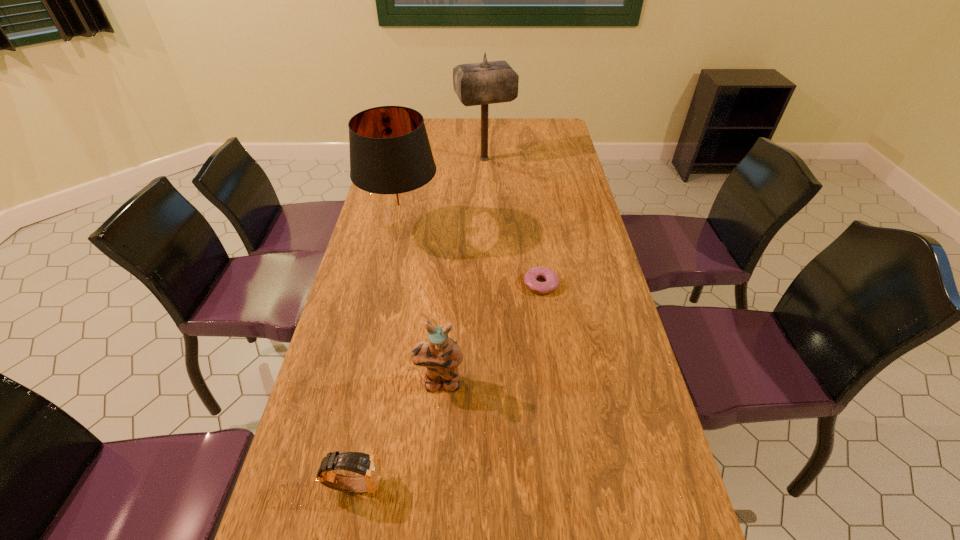
What are the coordinates of `mallet` in the screenshot? It's located at (484, 83).

At what (x,y) coordinates should I click in order to perform the action: click on lampshade. Please return your answer as a coordinate pair (x, y). The width and height of the screenshot is (960, 540). Looking at the image, I should click on (391, 160).

At what (x,y) coordinates should I click in order to perform the action: click on figurine. Please return your answer as a coordinate pair (x, y). Looking at the image, I should click on (441, 356).

Image resolution: width=960 pixels, height=540 pixels. I want to click on the third shortest object, so click(x=441, y=356).

I want to click on the fourth tallest object, so click(x=369, y=466).

What are the coordinates of `watch` in the screenshot? It's located at (369, 466).

Locate an element on the screen. This screenshot has width=960, height=540. the third nearest object is located at coordinates (530, 278).

What are the coordinates of `the shortest object` in the screenshot? It's located at (530, 278).

This screenshot has height=540, width=960. Find the location of `vacant space located 0.270m on the left of the mallet`. vacant space located 0.270m on the left of the mallet is located at coordinates [x=388, y=159].

The image size is (960, 540). What are the coordinates of `blank space located on the back of the second farthest object` in the screenshot? It's located at (417, 161).